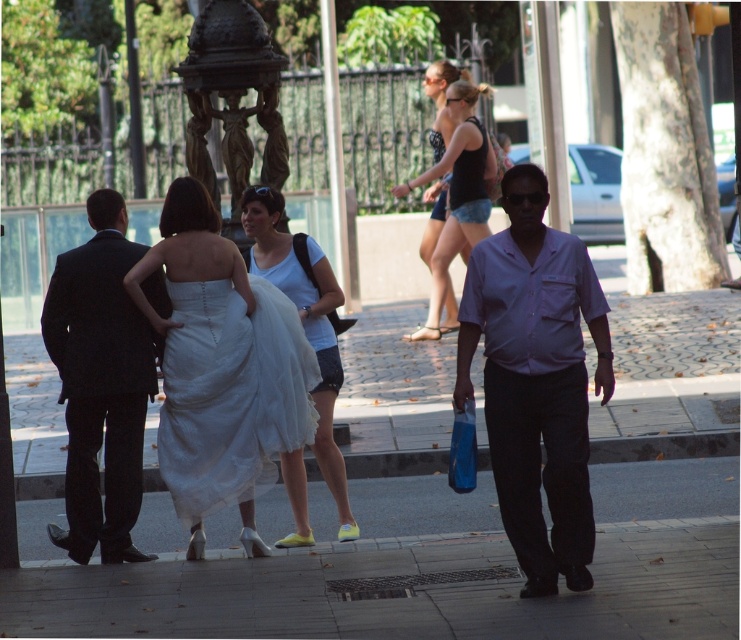
Question: Is purple cotton shirt at center to the right of black denim shorts at center from the viewer's perspective?

Choices:
 (A) no
 (B) yes

Answer: (B)

Question: Based on their relative distances, which object is farther from the white cotton dress at center?

Choices:
 (A) purple cotton shirt at center
 (B) white tulle dress at center
 (C) dark suit at left
 (D) black denim shorts at center

Answer: (D)

Question: Observing the image, what is the correct spatial positioning of purple cotton shirt at center in reference to black denim shorts at center?

Choices:
 (A) right
 (B) left

Answer: (A)

Question: Which object is farther from the camera taking this photo?

Choices:
 (A) white tulle dress at center
 (B) dark suit at left
 (C) white cotton dress at center

Answer: (C)

Question: Among these points, which one is farthest from the camera?

Choices:
 (A) (448, 145)
 (B) (559, 480)
 (C) (292, 372)

Answer: (A)

Question: Is purple cotton shirt at center positioned at the back of dark suit at left?

Choices:
 (A) yes
 (B) no

Answer: (B)